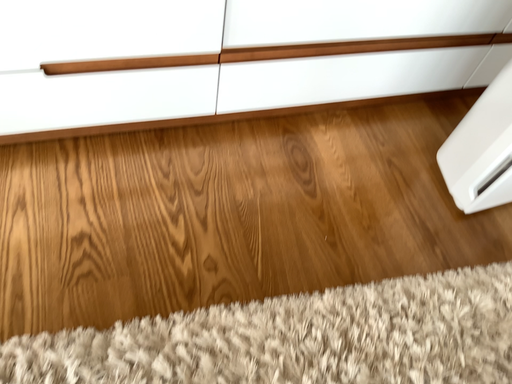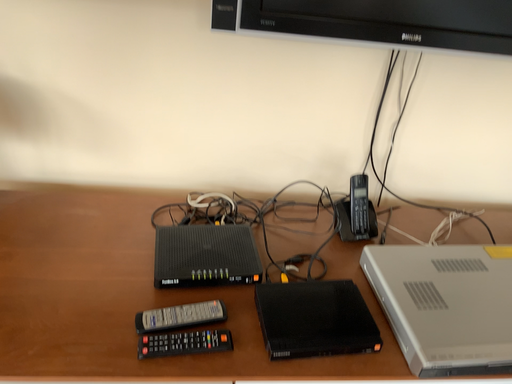
Question: Which way did the camera rotate in the video?

Choices:
 (A) rotated downward
 (B) rotated upward

Answer: (B)